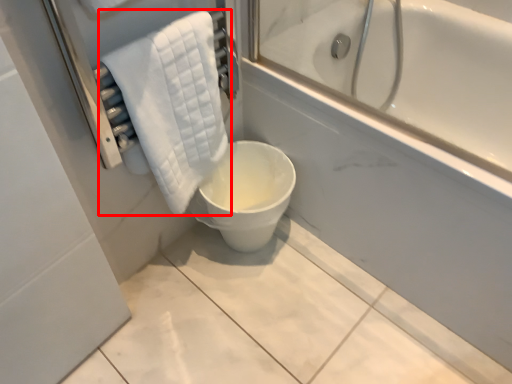
Question: From the image's perspective, where is towel (annotated by the red box) located in relation to toilet in the image?

Choices:
 (A) above
 (B) below

Answer: (A)